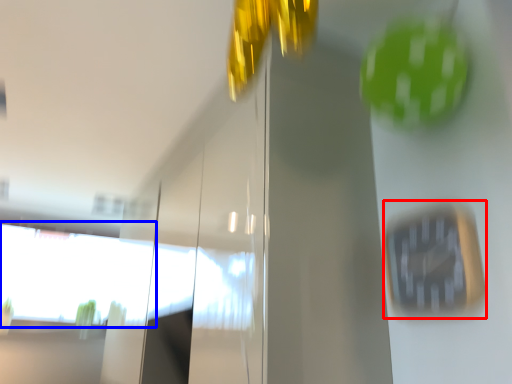
Question: Which point is further to the camera, clock (highlighted by a red box) or window (highlighted by a blue box)?

Choices:
 (A) clock
 (B) window

Answer: (B)